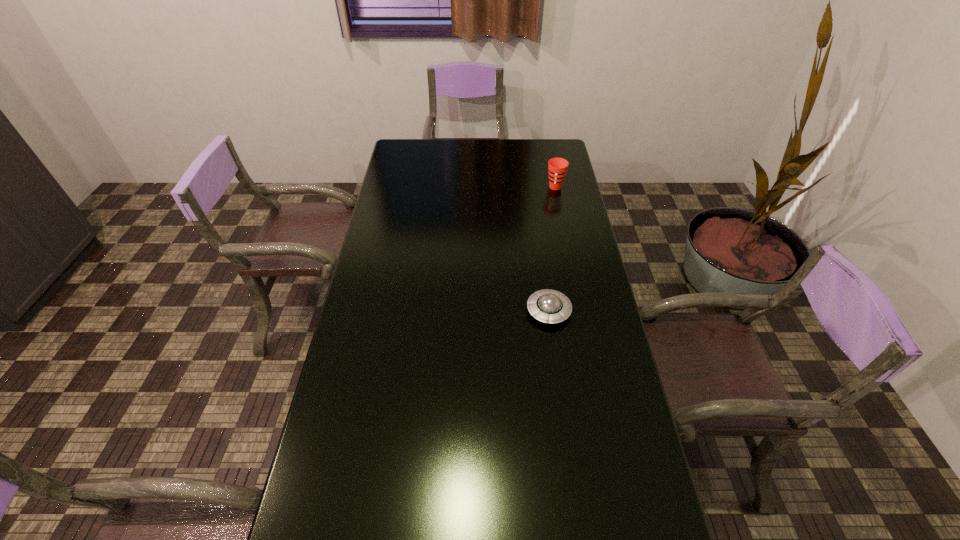
In the image, there is a desktop. Where is `vacant space at the right edge`? This screenshot has height=540, width=960. vacant space at the right edge is located at coordinates (552, 210).

At what (x,y) coordinates should I click in order to perform the action: click on free space at the far right corner. Please return your answer as a coordinate pair (x, y). This screenshot has width=960, height=540. Looking at the image, I should click on (533, 163).

Where is `blank region between the cup and the nearer object`? blank region between the cup and the nearer object is located at coordinates (552, 249).

Identify the location of unoccupied area between the shorter object and the taller object. The width and height of the screenshot is (960, 540). (552, 249).

At what (x,y) coordinates should I click in order to perform the action: click on free space between the taller object and the saucer. Please return your answer as a coordinate pair (x, y). Looking at the image, I should click on (552, 249).

You are a GUI agent. You are given a task and a screenshot of the screen. Output one action in this format:
    pyautogui.click(x=<x>, y=<y>)
    Task: Click on the empty location between the cup and the nearer object
    The width and height of the screenshot is (960, 540).
    Given the screenshot: What is the action you would take?
    pyautogui.click(x=552, y=249)

In order to click on blank space that satisfies the following two spatial constraints: 1. on the back side of the taller object; 2. on the left side of the shorter object in this screenshot , I will do `click(532, 187)`.